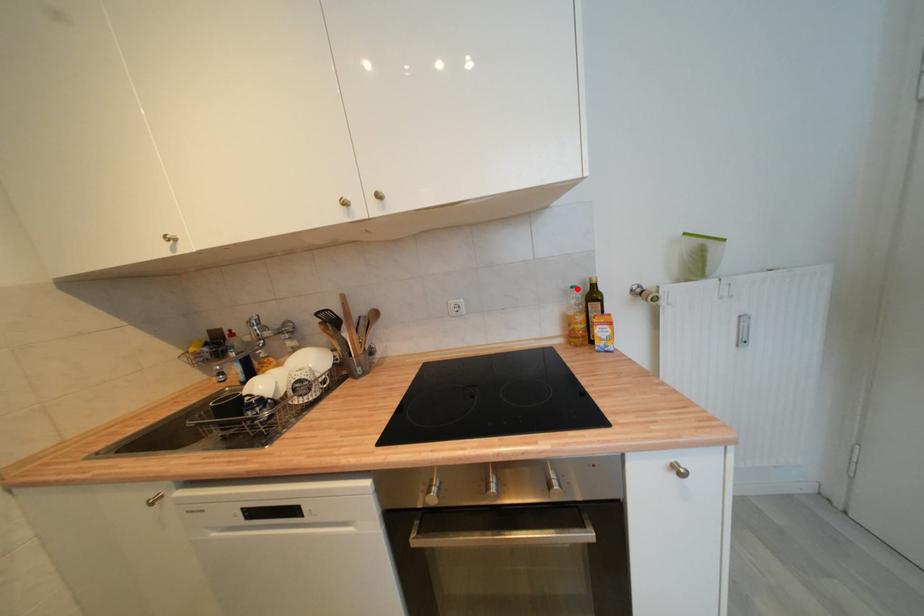
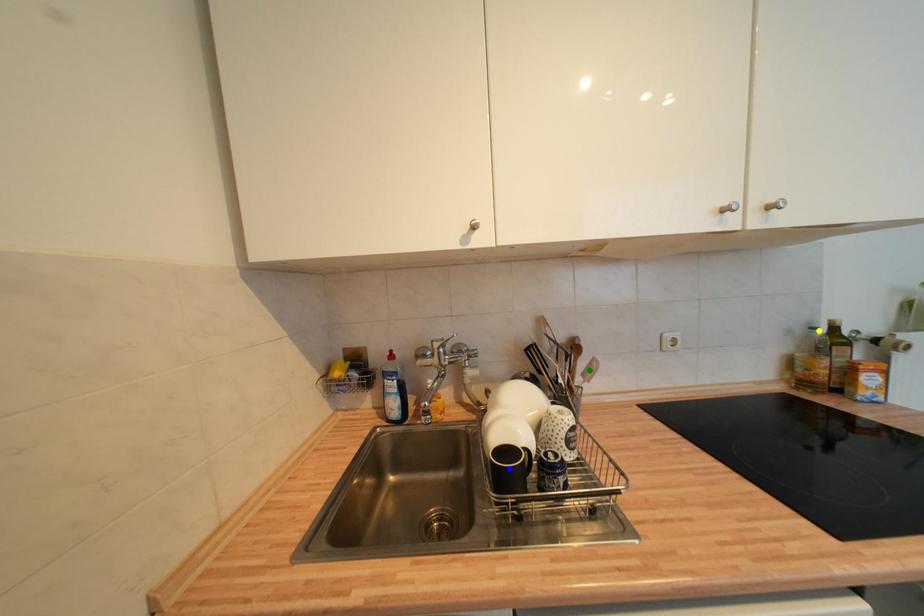
Question: I am providing you with two images of the same scene from different viewpoints. A red point is marked on the first image. You are given multiple points on the second image. Which point in image 2 represents the same 3d spot as the red point in image 1?

Choices:
 (A) blue point
 (B) green point
 (C) yellow point

Answer: (C)